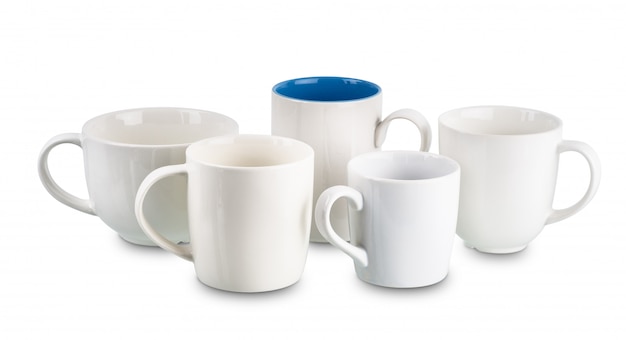
You are a GUI agent. You are given a task and a screenshot of the screen. Output one action in this format:
    pyautogui.click(x=<x>, y=<y>)
    Task: Click on the lip of mug
    The image size is (626, 340).
    Given the screenshot: What is the action you would take?
    pyautogui.click(x=254, y=169), pyautogui.click(x=143, y=147), pyautogui.click(x=398, y=181), pyautogui.click(x=499, y=136), pyautogui.click(x=324, y=103)